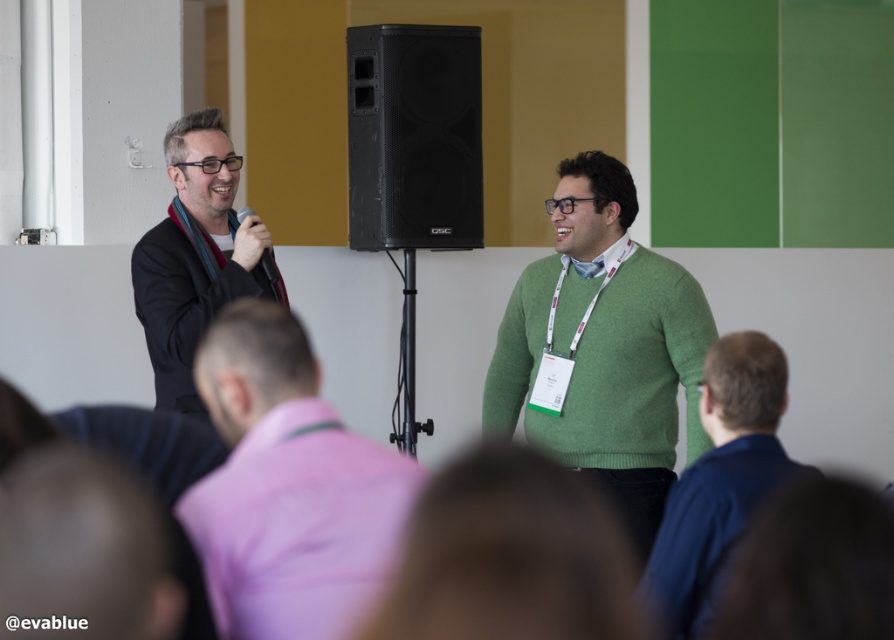
Question: Does black matte speaker at center have a lesser width compared to matte black suit at left?

Choices:
 (A) yes
 (B) no

Answer: (B)

Question: Which object is closer to the camera taking this photo?

Choices:
 (A) black matte speaker at center
 (B) matte black suit at left
 (C) blue fabric shirt at right

Answer: (C)

Question: Does pink fabric shirt at center come behind blue fabric shirt at right?

Choices:
 (A) no
 (B) yes

Answer: (A)

Question: Which point is farther to the camera?

Choices:
 (A) black matte speaker at center
 (B) green wool sweater at center
 (C) pink fabric shirt at center

Answer: (A)

Question: Which of these objects is positioned farthest from the blue fabric shirt at right?

Choices:
 (A) matte black microphone at upper center
 (B) matte black suit at left
 (C) black matte speaker at center
 (D) green wool sweater at center

Answer: (C)

Question: Does black matte speaker at center have a smaller size compared to matte black suit at left?

Choices:
 (A) yes
 (B) no

Answer: (A)